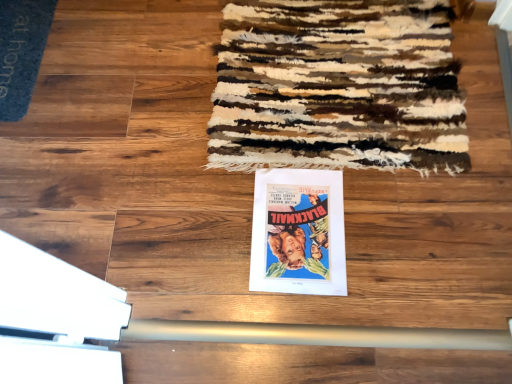
This screenshot has width=512, height=384. In order to click on vacant space to the right of matte paper poster at center in this screenshot , I will do `click(394, 219)`.